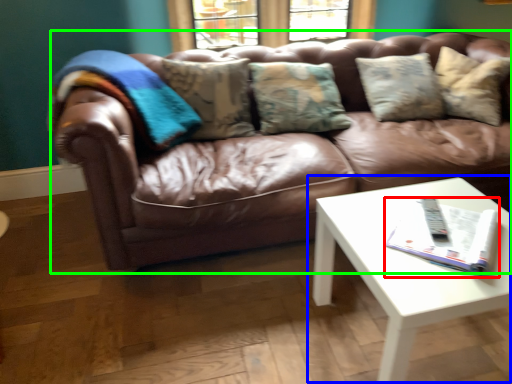
Question: Which object is positioned farthest from magazine (highlighted by a red box)? Select from coffee table (highlighted by a blue box) and studio couch (highlighted by a green box).

Choices:
 (A) coffee table
 (B) studio couch

Answer: (B)